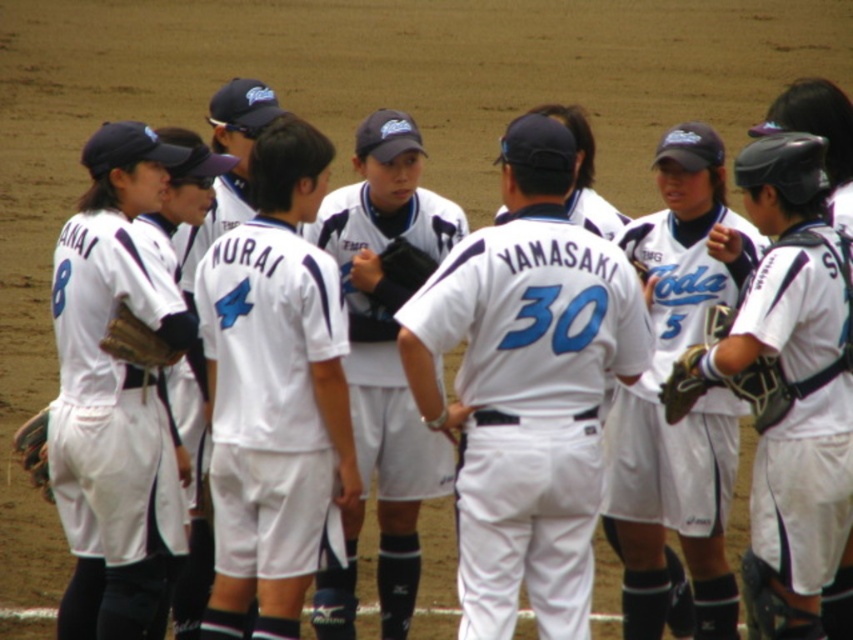
Does point (393, 250) come farther from viewer compared to point (134, 316)?

Yes, point (393, 250) is farther from viewer.

Who is more forward, (x=396, y=260) or (x=142, y=339)?

Point (x=142, y=339) is more forward.

Is point (415, 272) positioned before point (148, 358)?

No.

Locate an element on the screen. The image size is (853, 640). black leather glove at center is located at coordinates (398, 276).

Does point (161, 346) lie in front of point (22, 438)?

Yes, point (161, 346) is in front of point (22, 438).

Who is more distant from viewer, (158, 342) or (33, 426)?

Point (33, 426)

Describe the element at coordinates (135, 340) in the screenshot. The height and width of the screenshot is (640, 853). I see `brown leather glove at left` at that location.

Identify the location of brown leather glove at left. (135, 340).

Is white matte uniform at left closer to camera compared to white matte jersey at center?

No, it is not.

Does white matte uniform at left appear on the left side of white matte jersey at center?

Indeed, white matte uniform at left is positioned on the left side of white matte jersey at center.

Is point (122, 426) behind point (300, 404)?

Yes, it is behind point (300, 404).

Image resolution: width=853 pixels, height=640 pixels. I want to click on white matte uniform at left, so click(114, 400).